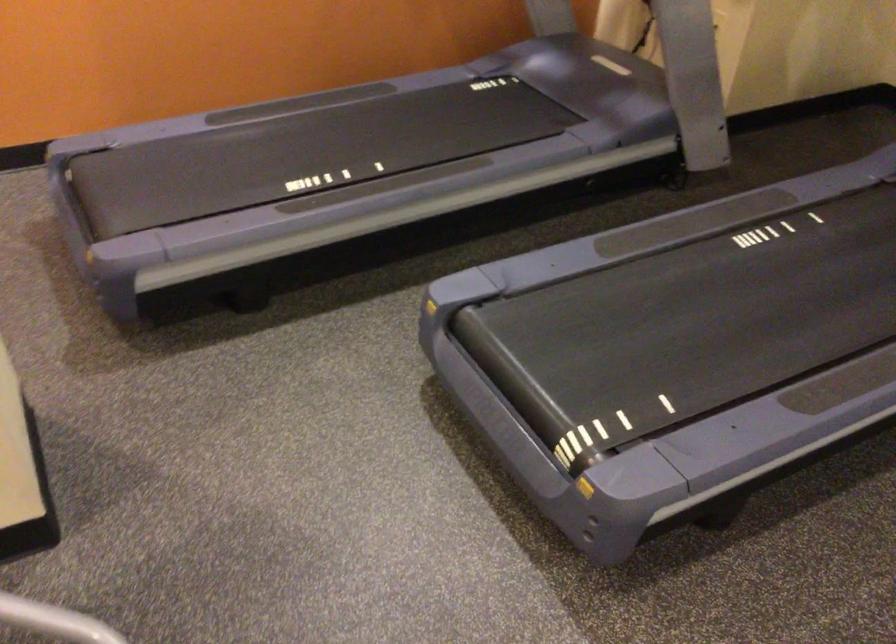
Question: The first image is from the beginning of the video and the second image is from the end. How did the camera likely rotate when shooting the video?

Choices:
 (A) Left
 (B) Right
 (C) Up
 (D) Down

Answer: (A)